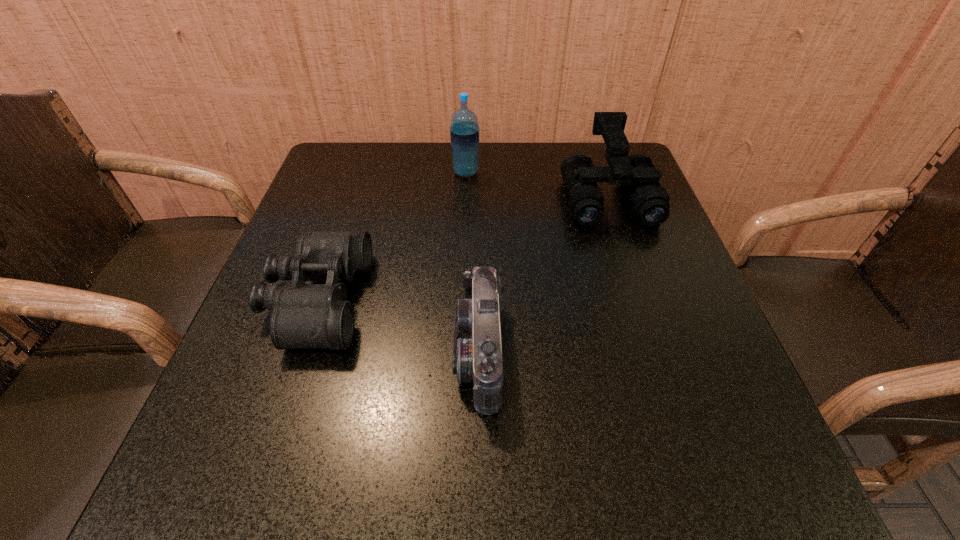
Identify the location of empty location between the water bottle and the nearer binoculars. (392, 237).

Locate an element on the screen. This screenshot has width=960, height=540. free area in between the shorter binoculars and the taller binoculars is located at coordinates (463, 248).

The image size is (960, 540). What are the coordinates of `object that can be found as the closest to the nearer binoculars` in the screenshot? It's located at (477, 352).

Identify which object is the second closest to the left binoculars. Please provide its 2D coordinates. Your answer should be formatted as a tuple, i.e. [(x, y)], where the tuple contains the x and y coordinates of a point satisfying the conditions above.

[(464, 131)]

Locate an element on the screen. free point that satisfies the following two spatial constraints: 1. on the front lenses of the second tallest object; 2. on the front-facing side of the camcorder is located at coordinates (660, 353).